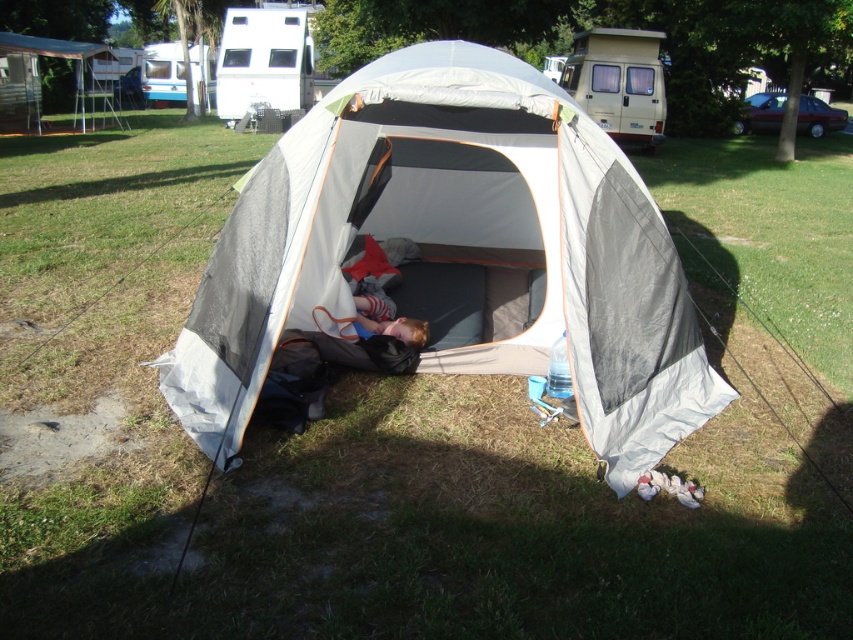
In the scene shown: Can you confirm if white fabric tent at center is positioned below white plastic camper at upper left?

Indeed, white fabric tent at center is positioned under white plastic camper at upper left.

Is point (448, 372) in front of point (223, 22)?

Yes, point (448, 372) is closer to viewer.

Find the location of a particular element. This screenshot has width=853, height=640. white fabric tent at center is located at coordinates (456, 253).

Between white fabric tent at center and metallic silver van at upper right, which one is positioned lower?

white fabric tent at center

Does white fabric tent at center appear on the left side of metallic silver van at upper right?

Yes, white fabric tent at center is to the left of metallic silver van at upper right.

I want to click on white fabric tent at center, so click(456, 253).

This screenshot has width=853, height=640. Identify the location of white fabric tent at center. (456, 253).

Which is more to the left, white fabric canopy at upper left or blue metallic trailer at upper left?

white fabric canopy at upper left

Consider the image. Is white fabric canopy at upper left taller than blue metallic trailer at upper left?

Yes.

Does point (109, 97) lie in front of point (161, 81)?

Yes.

Where is `white fabric canopy at upper left`? The width and height of the screenshot is (853, 640). white fabric canopy at upper left is located at coordinates (38, 77).